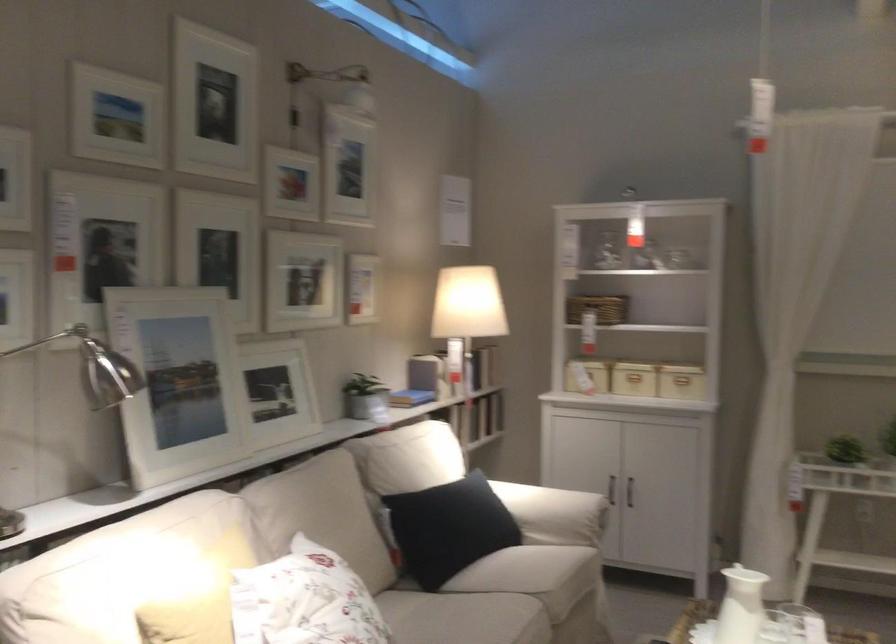
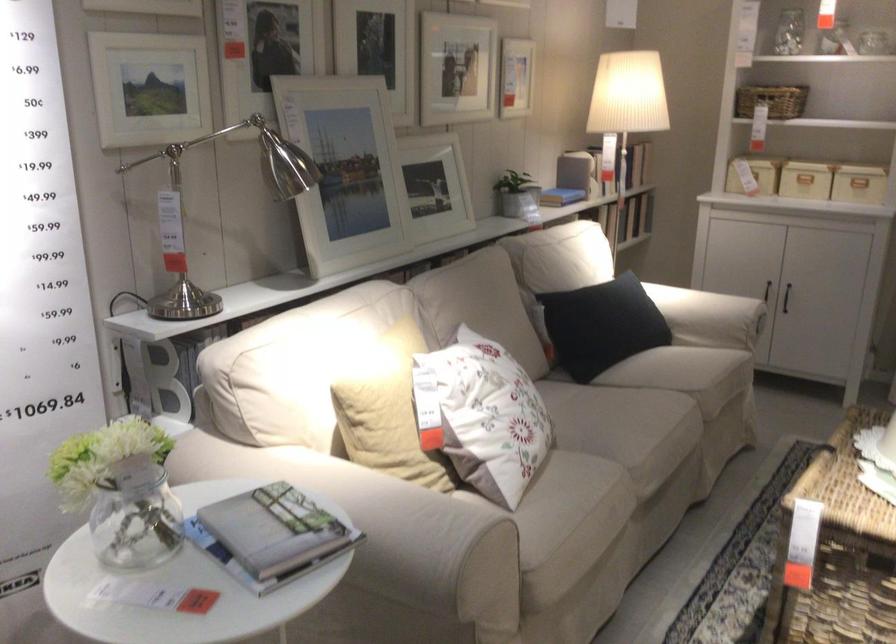
Find the pixel in the second image that matches (613,496) in the first image.

(765, 290)